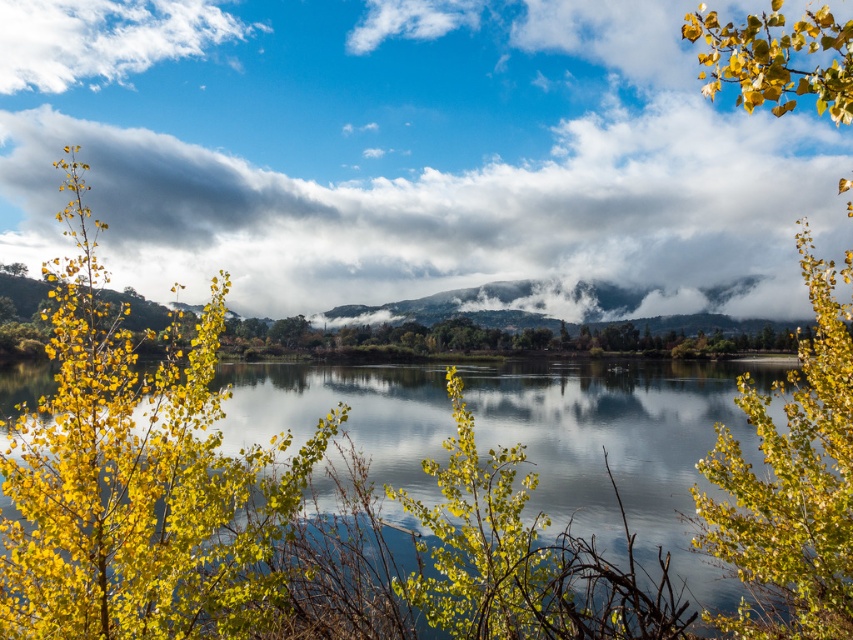
At what (x,y) coordinates should I click in order to perform the action: click on cloudy sky at upper center. Please return your answer as a coordinate pair (x, y). The width and height of the screenshot is (853, 640). Looking at the image, I should click on (410, 154).

Can you confirm if cloudy sky at upper center is positioned below white fluffy cloud at upper left?

Yes, cloudy sky at upper center is below white fluffy cloud at upper left.

This screenshot has height=640, width=853. What do you see at coordinates (410, 154) in the screenshot?
I see `cloudy sky at upper center` at bounding box center [410, 154].

Where is `cloudy sky at upper center`? cloudy sky at upper center is located at coordinates (410, 154).

Where is `clear water at center`? Image resolution: width=853 pixels, height=640 pixels. clear water at center is located at coordinates (277, 529).

Does clear water at center have a lesser width compared to white fluffy cloud at upper left?

Correct, clear water at center's width is less than white fluffy cloud at upper left's.

Identify the location of clear water at center. (277, 529).

Find the location of `clear water at center`. clear water at center is located at coordinates pos(277,529).

Who is taller, clear water at center or yellow leafy tree at left?

Standing taller between the two is yellow leafy tree at left.

Which is in front, point (352, 524) or point (122, 563)?

Positioned in front is point (122, 563).

Is point (811, 605) positioned before point (160, 529)?

Yes, it is in front of point (160, 529).

This screenshot has width=853, height=640. In order to click on clear water at center in this screenshot , I will do `click(277, 529)`.